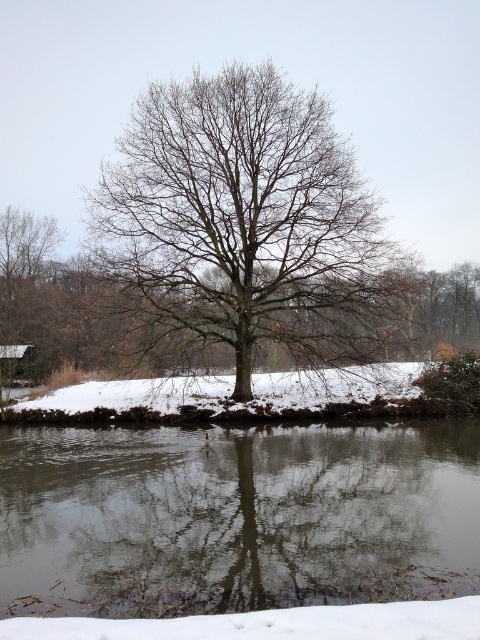
You are an artist trying to sketch the winter scene. You notice the transparent ice at center and the bare branches tree at center. Which object should you draw first if you want to follow the rule of starting with the larger object?

You should draw the bare branches tree at center first because it is larger than the transparent ice at center.

Looking at the winter scene, you notice the transparent ice at center and the bare branches tree at center. Which object is shorter in height?

The transparent ice at center is not as tall as the bare branches tree at center, so the transparent ice at center is shorter.

You are an observer looking at the winter scene. You notice the transparent ice at center and the bare branches tree at center. Which object is positioned to the left of the other?

The transparent ice at center is to the left of the bare branches tree at center.